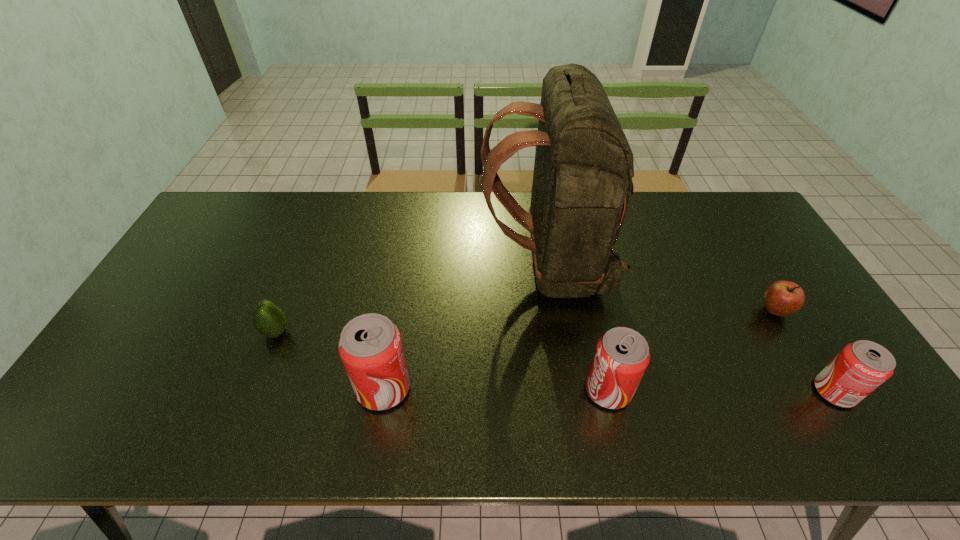
Where is `free space located on the back of the third shortest object`? The image size is (960, 540). free space located on the back of the third shortest object is located at coordinates (782, 307).

This screenshot has height=540, width=960. I want to click on free space located on the back of the leftmost object, so click(308, 252).

The width and height of the screenshot is (960, 540). What are the coordinates of `free location located on the back of the tallest object` in the screenshot? It's located at (444, 266).

Locate an element on the screen. This screenshot has height=540, width=960. free region located on the back of the tallest object is located at coordinates (387, 266).

Locate an element on the screen. The height and width of the screenshot is (540, 960). vacant space located 0.100m on the back of the tallest object is located at coordinates (448, 266).

Locate an element on the screen. free spot located on the front of the apple is located at coordinates (813, 375).

Find the location of a particular element. object that is at the far edge is located at coordinates (582, 184).

Identify the location of soda can that is at the right edge. (860, 367).

Where is `apple at the right edge`? apple at the right edge is located at coordinates (782, 298).

Locate an element on the screen. object that is at the near right corner is located at coordinates (860, 367).